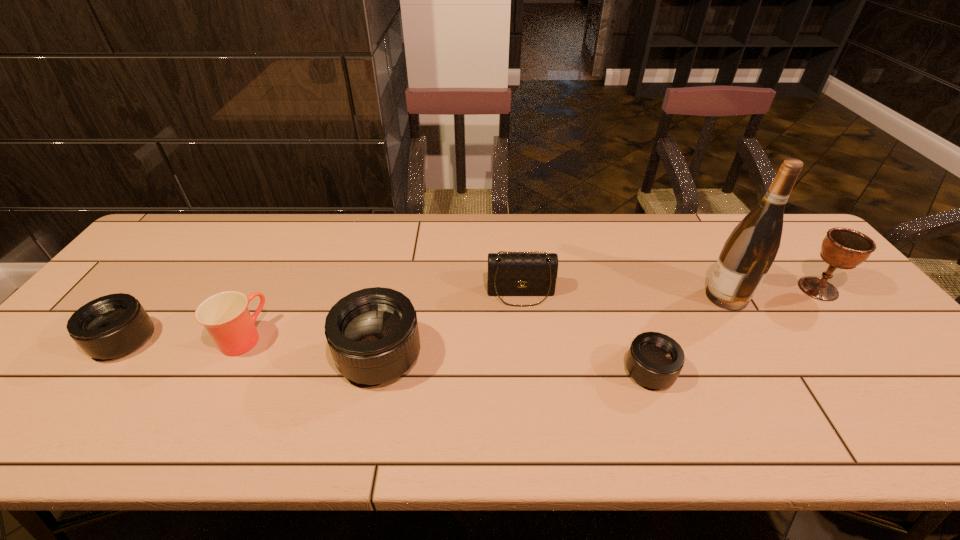
Where is `free location located 0.090m on the left of the sixth shortest object`? The height and width of the screenshot is (540, 960). free location located 0.090m on the left of the sixth shortest object is located at coordinates (767, 289).

Locate an element on the screen. The image size is (960, 540). vacant region located on the left of the second object from left to right is located at coordinates (196, 338).

I want to click on object that is at the left edge, so click(111, 326).

Where is `object at the right edge`? The width and height of the screenshot is (960, 540). object at the right edge is located at coordinates (843, 248).

The width and height of the screenshot is (960, 540). Identify the location of vacant point at the far edge. (x=458, y=240).

Where is `free space at the near edge of the desktop`? The width and height of the screenshot is (960, 540). free space at the near edge of the desktop is located at coordinates (799, 375).

I want to click on vacant space at the right edge of the desktop, so click(901, 346).

Locate an element on the screen. The height and width of the screenshot is (540, 960). vacant area that lies between the fifth object from left to right and the second object from left to right is located at coordinates (446, 355).

Locate an element on the screen. vacant area that lies between the clutch bag and the tallest object is located at coordinates (624, 295).

Image resolution: width=960 pixels, height=540 pixels. Find the location of `free space that is in between the second telephoto lens from left to right and the cup`. free space that is in between the second telephoto lens from left to right and the cup is located at coordinates (310, 347).